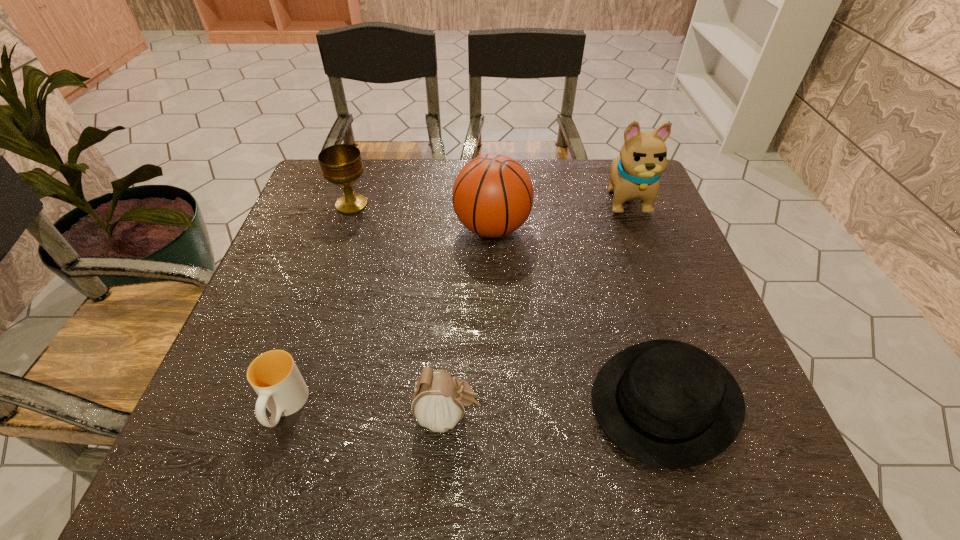
Locate an element on the screen. vacant region at the near left corner is located at coordinates (233, 464).

What are the coordinates of `free space between the second tallest object and the pouch` in the screenshot? It's located at (470, 322).

This screenshot has height=540, width=960. In order to click on free spot between the puppy and the fourth tallest object in this screenshot , I will do `click(537, 307)`.

Find the location of `vacant space that's between the cup and the puppy`. vacant space that's between the cup and the puppy is located at coordinates (455, 303).

Locate an element on the screen. free area in between the cup and the puppy is located at coordinates (455, 303).

Locate an element on the screen. vacant area between the cup and the shortest object is located at coordinates (475, 404).

Where is `vacant region between the third tallest object and the shortest object`? vacant region between the third tallest object and the shortest object is located at coordinates (509, 302).

This screenshot has height=540, width=960. Find the location of `free area in between the chalice and the fifth shortest object`. free area in between the chalice and the fifth shortest object is located at coordinates (421, 217).

Where is `vacant area between the fourth shortest object and the fourth tallest object`? vacant area between the fourth shortest object and the fourth tallest object is located at coordinates (399, 310).

Locate an element on the screen. The width and height of the screenshot is (960, 540). free point between the cup and the pouch is located at coordinates (366, 411).